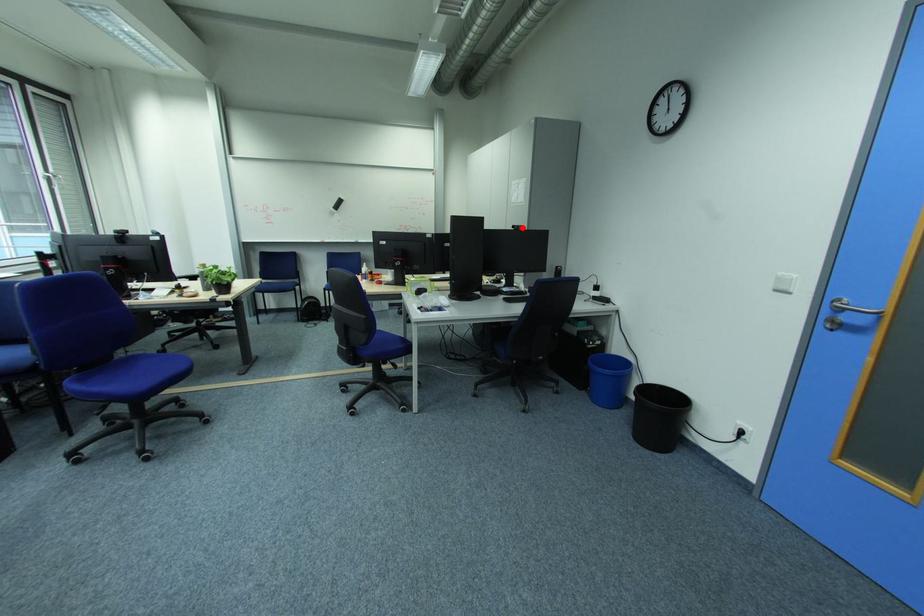
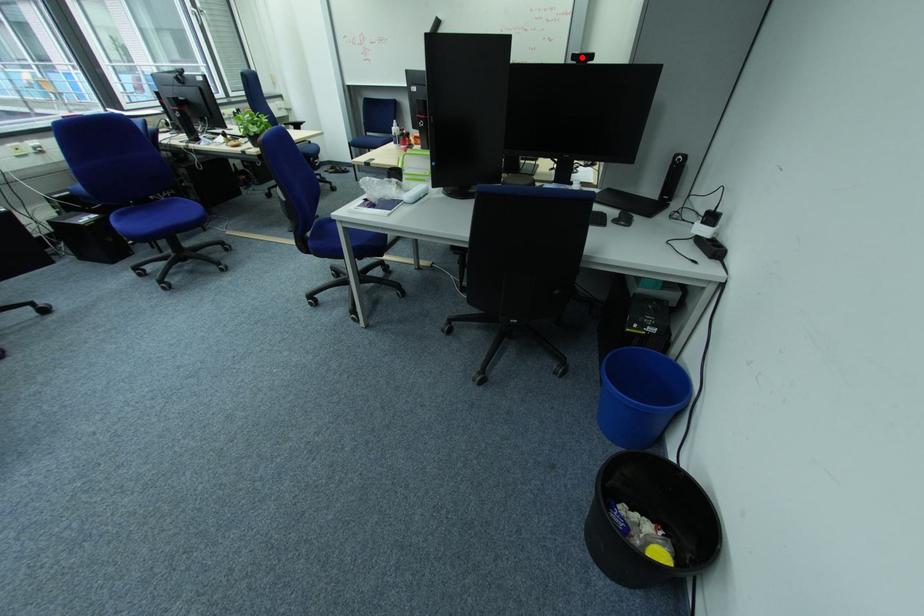
I am providing you with two images of the same scene from different viewpoints. A red point is marked on the first image and another point is marked on the second image. Is the red point in image1 aligned with the point shown in image2?

Yes